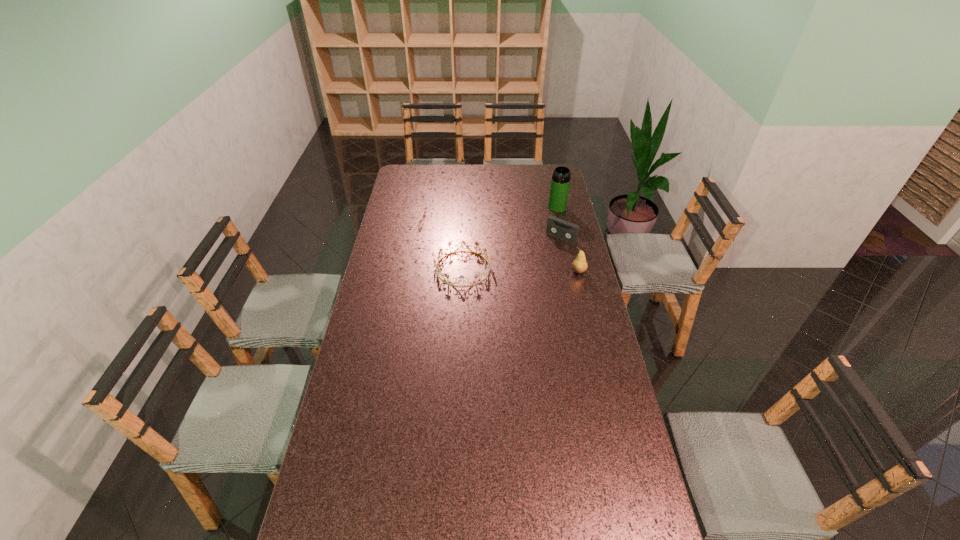
The height and width of the screenshot is (540, 960). I want to click on tiara, so click(x=449, y=243).

The height and width of the screenshot is (540, 960). I want to click on pear, so click(579, 265).

Find the location of a particular element. This screenshot has width=960, height=540. thermos bottle is located at coordinates (560, 183).

I want to click on the farthest object, so click(x=560, y=183).

The image size is (960, 540). Find the location of `the second farthest object`. the second farthest object is located at coordinates (556, 227).

Locate an element on the screen. This screenshot has height=540, width=960. vacant area located on the front-facing side of the leftmost object is located at coordinates (534, 268).

I want to click on vacant space located on the front of the pear, so click(x=594, y=335).

In order to click on free space located 0.390m from the spout of the farthest object in this screenshot , I will do `click(540, 261)`.

At what (x,y) coordinates should I click in order to perform the action: click on vacant space located from the spout of the farthest object. Please return your answer as a coordinate pair (x, y). This screenshot has height=540, width=960. Looking at the image, I should click on (543, 248).

At what (x,y) coordinates should I click in order to perform the action: click on vacant region located from the spout of the farthest object. Please return your answer as a coordinate pair (x, y). Looking at the image, I should click on (545, 242).